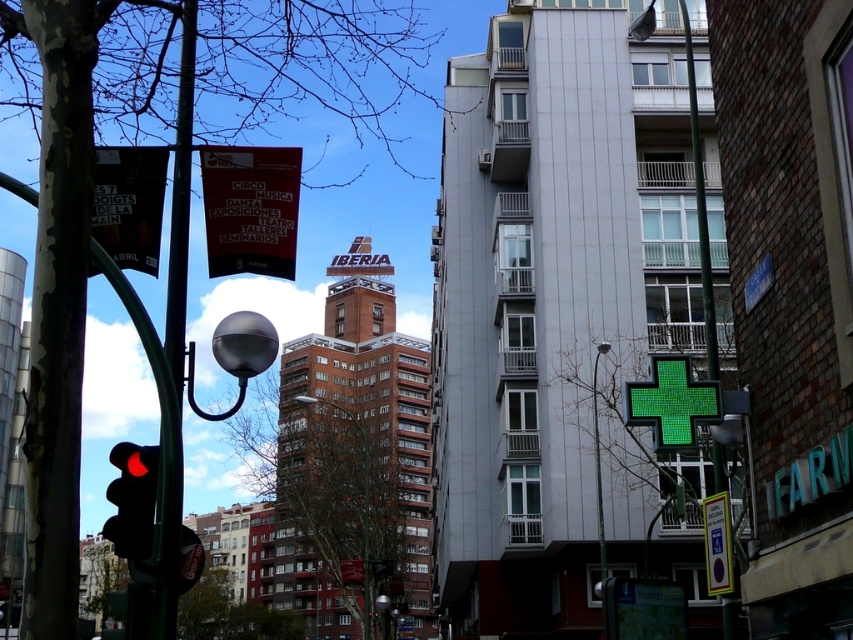
Based on the photo, can you confirm if green plastic sign at lower right is shorter than brown wooden pole at center?

Yes.

Is point (715, 563) positioned before point (331, 401)?

Yes, point (715, 563) is closer to viewer.

Find the location of `green plastic sign at lower right`. green plastic sign at lower right is located at coordinates (717, 544).

Between black glass traffic light at left and green plastic sign at lower right, which one has less height?

Standing shorter between the two is green plastic sign at lower right.

This screenshot has height=640, width=853. I want to click on black glass traffic light at left, so click(x=132, y=499).

Does black glass traffic light at left have a greater width compared to brown wooden pole at center?

Yes, black glass traffic light at left is wider than brown wooden pole at center.

Who is more distant from viewer, (155, 468) or (308, 397)?

Point (308, 397)

The width and height of the screenshot is (853, 640). What are the coordinates of `black glass traffic light at left` in the screenshot? It's located at (132, 499).